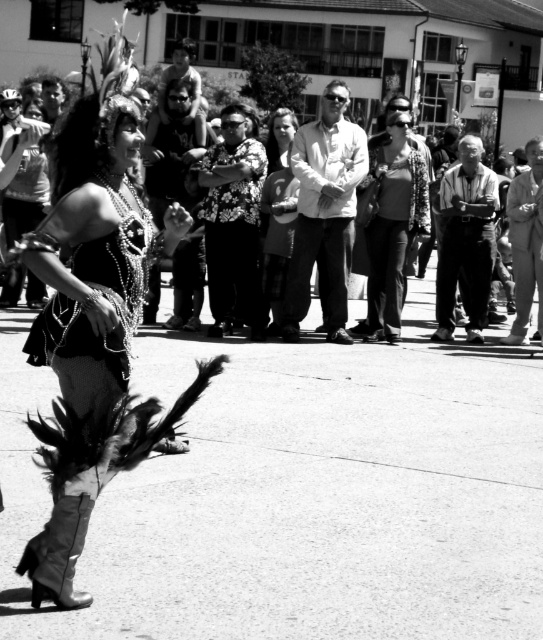
In the scene shown: You are a photographer trying to capture the dancer in the scene. You notice two items of matte black clothing at center and matte black jacket at center. Which item would you focus on if you want to photograph the larger object?

The matte black jacket at center is larger than the matte black clothing at center, so you should focus on the matte black jacket at center to photograph the larger object.

You are a photographer trying to capture a closeup of the dancer. You notice the dark gray pants at center and the matte black dress at center. Which one is wider?

The dark gray pants at center might be wider than matte black dress at center.